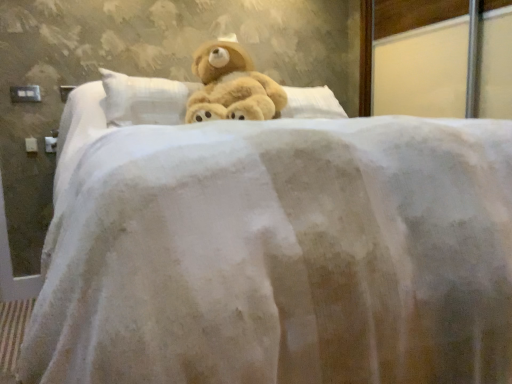
What is the approximate height of soft beige plush at center?

16.61 inches.

Find the location of a particular element. Image resolution: width=512 pixels, height=384 pixels. soft beige plush at center is located at coordinates (231, 86).

What do you see at coordinates (231, 86) in the screenshot?
I see `soft beige plush at center` at bounding box center [231, 86].

What is the approximate width of soft beige plush at center?

The width of soft beige plush at center is 24.52 inches.

Identify the location of soft beige plush at center. (231, 86).